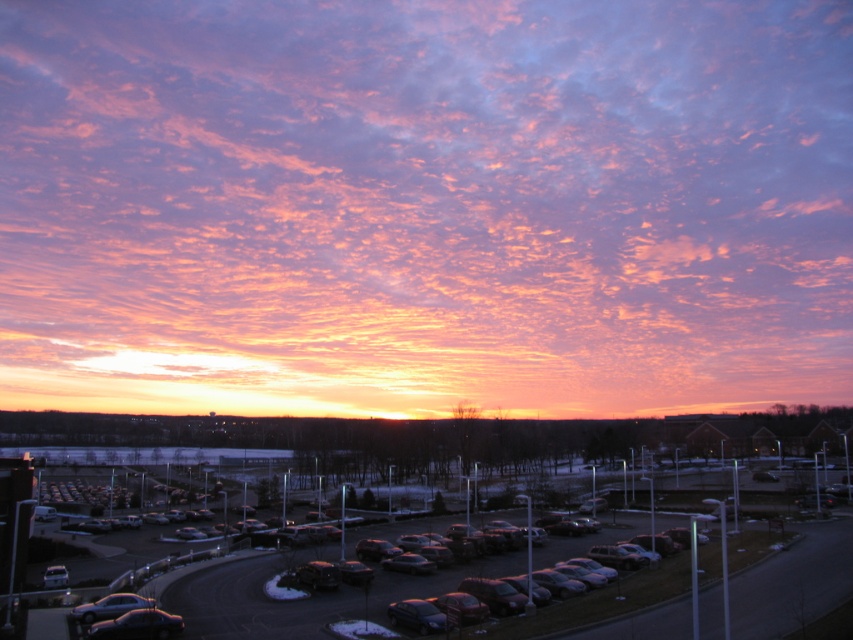
Question: Estimate the real-world distances between objects in this image. Which object is farther from the black asphalt parking lot at lower center?

Choices:
 (A) pink fluffy clouds at upper center
 (B) shiny black car at lower left

Answer: (A)

Question: Does pink fluffy clouds at upper center have a smaller size compared to black asphalt parking lot at lower center?

Choices:
 (A) yes
 (B) no

Answer: (B)

Question: Among these objects, which one is farthest from the camera?

Choices:
 (A) black asphalt parking lot at lower center
 (B) pink fluffy clouds at upper center

Answer: (B)

Question: Observing the image, what is the correct spatial positioning of pink fluffy clouds at upper center in reference to shiny black car at lower left?

Choices:
 (A) below
 (B) above

Answer: (B)

Question: Can you confirm if black asphalt parking lot at lower center is wider than shiny black car at lower left?

Choices:
 (A) no
 (B) yes

Answer: (B)

Question: Which object is farther from the camera taking this photo?

Choices:
 (A) black asphalt parking lot at lower center
 (B) pink fluffy clouds at upper center

Answer: (B)